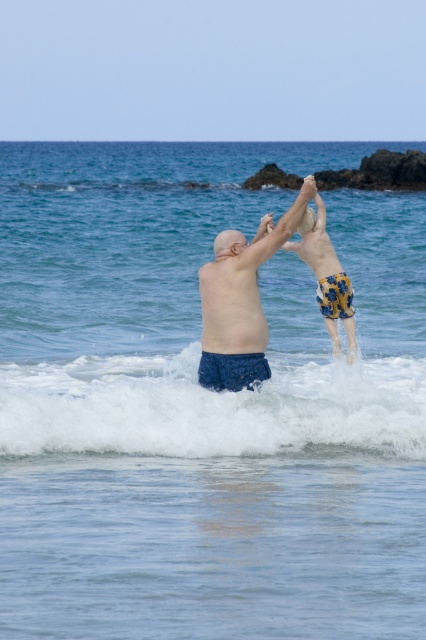
Does blue fabric shorts at center appear on the left side of blue textured shorts at center?

Yes, blue fabric shorts at center is to the left of blue textured shorts at center.

Which is in front, point (241, 372) or point (325, 237)?

Point (241, 372) is in front.

Where is `blue fabric shorts at center`? This screenshot has height=640, width=426. blue fabric shorts at center is located at coordinates (239, 301).

Is white foamy wave at center wider than blue fabric shorts at center?

Yes.

Does white foamy wave at center come behind blue fabric shorts at center?

No, it is not.

Who is more forward, (72, 406) or (264, 316)?

Point (72, 406)

Where is `white foamy wave at center`? Image resolution: width=426 pixels, height=640 pixels. white foamy wave at center is located at coordinates (212, 406).

Between white foamy wave at center and blue textured shorts at center, which one has less height?

Standing shorter between the two is white foamy wave at center.

In the scene shown: Who is more distant from viewer, (417, 403) or (333, 280)?

Positioned behind is point (333, 280).

The width and height of the screenshot is (426, 640). What are the coordinates of `white foamy wave at center` in the screenshot? It's located at (212, 406).